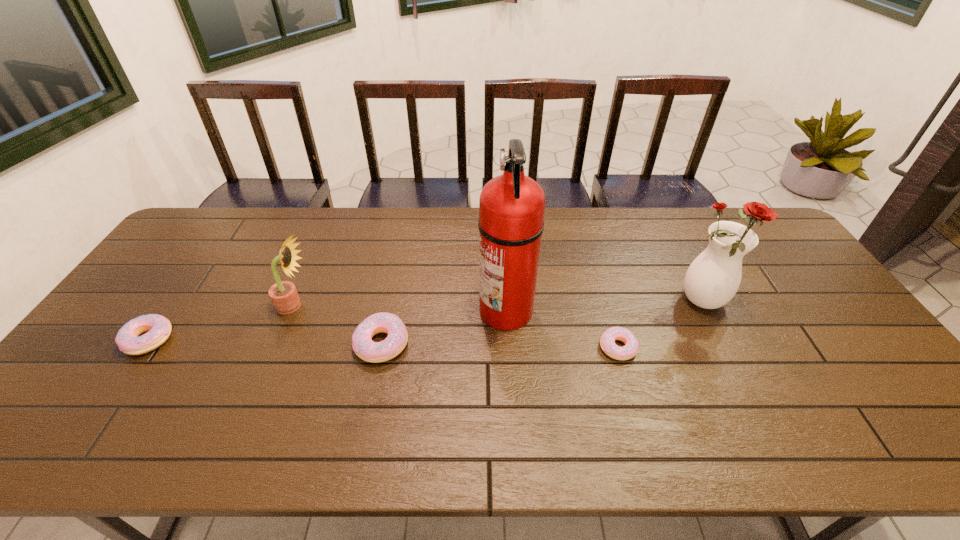
At what (x,y) coordinates should I click in order to perform the action: click on the leftmost object. Please return your answer as a coordinate pair (x, y). Image resolution: width=960 pixels, height=540 pixels. Looking at the image, I should click on (128, 339).

Find the location of a particular element. This screenshot has width=960, height=540. the leftmost doughnut is located at coordinates (128, 339).

Where is `the second doughnut from right to left`? This screenshot has height=540, width=960. the second doughnut from right to left is located at coordinates (375, 352).

Locate an element on the screen. the third shortest object is located at coordinates (375, 352).

You are a GUI agent. You are given a task and a screenshot of the screen. Output one action in this format:
    pyautogui.click(x=<x>, y=<y>)
    Task: Click on the fifth object from left to right
    
    Given the screenshot: What is the action you would take?
    pyautogui.click(x=607, y=341)

At what (x,y) coordinates should I click in order to perform the action: click on the shortest doughnut. Please return your answer as a coordinate pair (x, y). Looking at the image, I should click on (607, 341).

This screenshot has height=540, width=960. What are the coordinates of `the second tallest object` in the screenshot? It's located at (713, 278).

The width and height of the screenshot is (960, 540). Identify the location of vase. (713, 278).

The width and height of the screenshot is (960, 540). Find the location of `the third object from right to left`. the third object from right to left is located at coordinates (511, 208).

Identify the location of the tallest object. (511, 208).